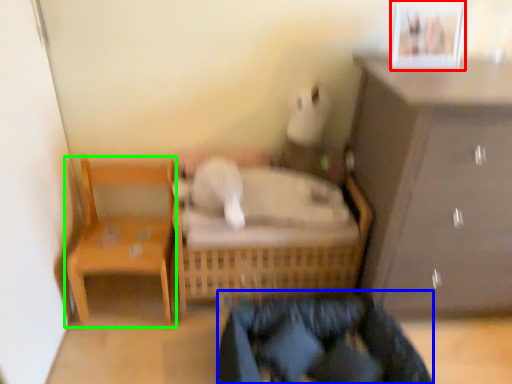
Question: Which object is the closest to the picture frame (highlighted by a red box)? Choose among these: clothing (highlighted by a blue box) or chair (highlighted by a green box).

Choices:
 (A) clothing
 (B) chair

Answer: (A)